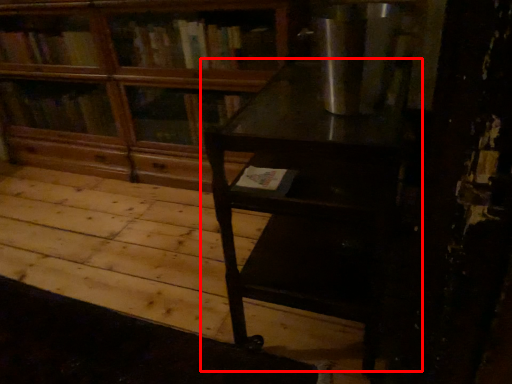
Question: Observing the image, what is the correct spatial positioning of table (annotated by the red box) in reference to bookcase?

Choices:
 (A) right
 (B) left

Answer: (A)